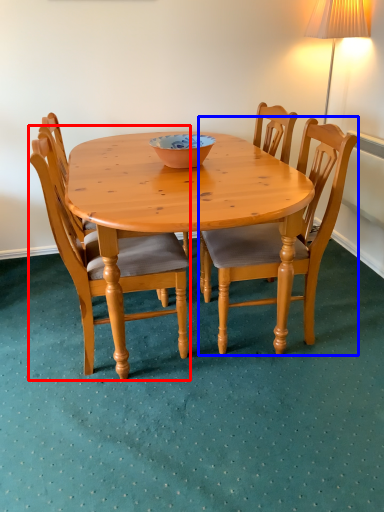
Question: Among these objects, which one is nearest to the camera, chair (highlighted by a red box) or chair (highlighted by a blue box)?

Choices:
 (A) chair
 (B) chair

Answer: (A)